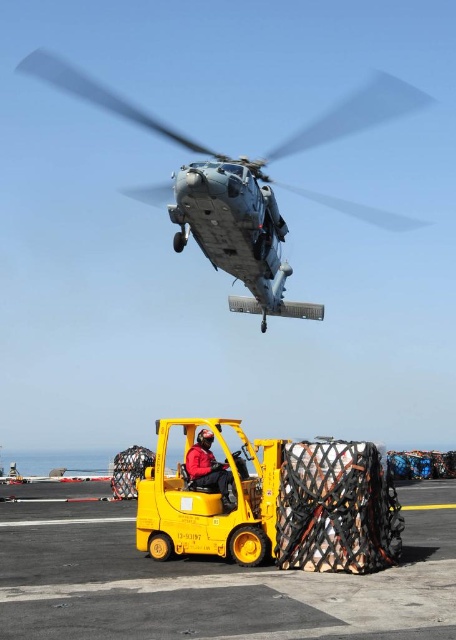
You are a deckhand on the ship and need to determine if the metallic gray helicopter at upper center can pass under a low clearance bridge that the red fabric jacket at center is currently under. Based on their heights, will the helicopter fit under the bridge?

The metallic gray helicopter at upper center is taller than the red fabric jacket at center. Since the jacket is under the bridge, the helicopter, being taller, may not fit under the same clearance. Therefore, it might not pass safely.

You are a crane operator trying to lift a cargo container from the deck of an aircraft carrier. There is a metallic gray helicopter at upper center and a red fabric jacket at center in your way. Can you safely move the cargo container between them without hitting either object?

The metallic gray helicopter at upper center might be wider than the red fabric jacket at center, so there is a possibility that the helicopter could block the path. To safely move the cargo container between them, you need to ensure there is enough space between the two objects. If the helicopter is indeed wider, you might need to adjust the path to avoid collision.